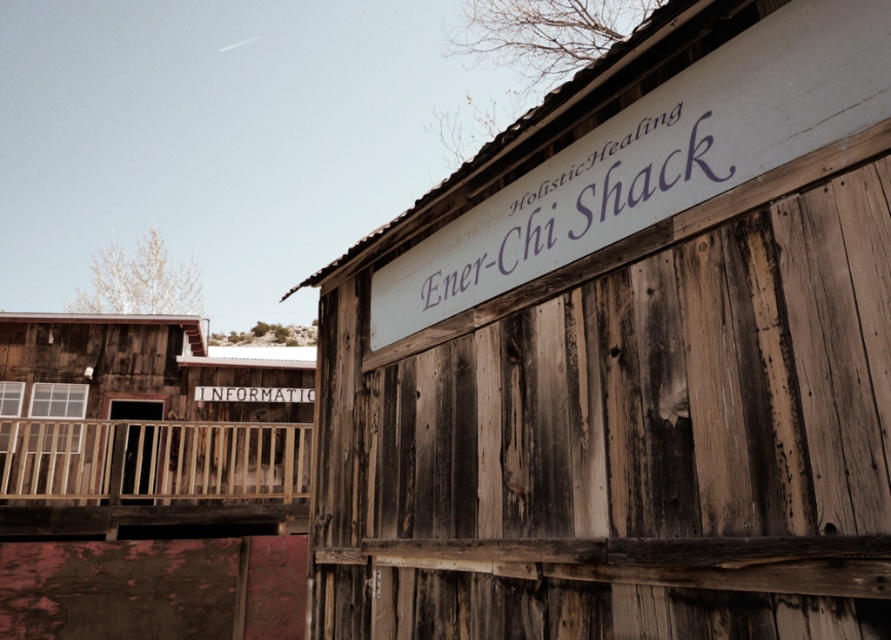
Between weathered wood information sign at left and purple painted wood sign at upper center, which one has less height?

purple painted wood sign at upper center is shorter.

Between point (34, 525) and point (520, 262), which one is positioned in front?

Point (520, 262)

Who is more forward, (285, 368) or (737, 112)?

Point (737, 112)

Locate an element on the screen. weathered wood information sign at left is located at coordinates (146, 481).

Does weathered wood barn at upper right have a lesser height compared to wooden at left?

No.

Between point (541, 432) and point (62, 432), which one is positioned in front?

Point (541, 432) is more forward.

The image size is (891, 640). What do you see at coordinates (628, 355) in the screenshot? I see `weathered wood barn at upper right` at bounding box center [628, 355].

Find the location of `weathered wood barn at upper right`. weathered wood barn at upper right is located at coordinates (628, 355).

Which is below, weathered wood barn at upper right or weathered wood information sign at left?

weathered wood information sign at left is below.

This screenshot has height=640, width=891. I want to click on weathered wood barn at upper right, so click(628, 355).

What are the coordinates of `weathered wood barn at upper right` in the screenshot? It's located at (628, 355).